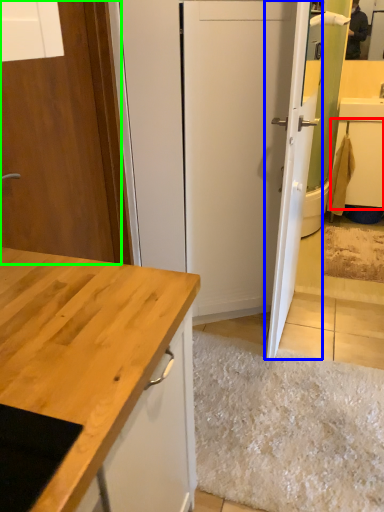
Question: Considering the real-world distances, which object is closest to cabinetry (highlighted by a red box)? door (highlighted by a blue box) or door (highlighted by a green box).

Choices:
 (A) door
 (B) door

Answer: (A)